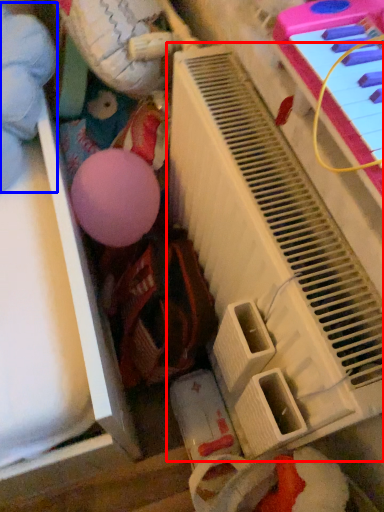
Question: Which point is closer to the camera, piano (highlighted by a red box) or toy (highlighted by a blue box)?

Choices:
 (A) piano
 (B) toy

Answer: (A)